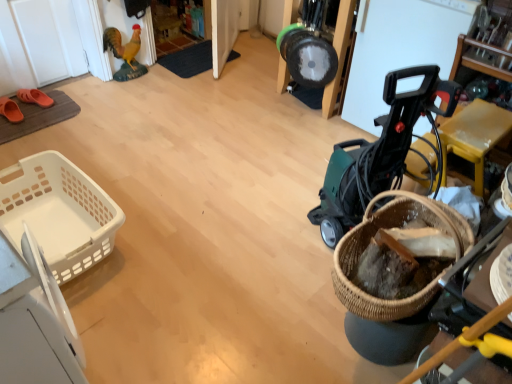
Question: Is woven brown basket at lower right, the 2th basket viewed from the left, next to orange rubber clog at left, which ranks as the 1th footwear in back-to-front order, and touching it?

Choices:
 (A) no
 (B) yes

Answer: (A)

Question: Would you say woven brown basket at lower right, positioned as the 2th basket in back-to-front order, is outside orange rubber clog at left, which ranks as the 1th footwear in back-to-front order?

Choices:
 (A) no
 (B) yes

Answer: (B)

Question: Considering the relative positions of woven brown basket at lower right, positioned as the 2th basket in back-to-front order, and orange rubber clog at left, which ranks as the 1th footwear in back-to-front order, in the image provided, is woven brown basket at lower right, positioned as the 2th basket in back-to-front order, to the left of orange rubber clog at left, which ranks as the 1th footwear in back-to-front order, from the viewer's perspective?

Choices:
 (A) yes
 (B) no

Answer: (B)

Question: Does woven brown basket at lower right, arranged as the 1th basket when viewed from the front, have a smaller size compared to orange rubber clog at left, marked as the 2th footwear in a front-to-back arrangement?

Choices:
 (A) yes
 (B) no

Answer: (B)

Question: Does woven brown basket at lower right, the 2th basket viewed from the left, have a greater width compared to orange rubber clog at left, marked as the 2th footwear in a front-to-back arrangement?

Choices:
 (A) yes
 (B) no

Answer: (B)

Question: From their relative heights in the image, would you say orange rubber sandals at left, the second footwear in the back-to-front sequence, is taller or shorter than green plastic baby carriage at right?

Choices:
 (A) tall
 (B) short

Answer: (B)

Question: Based on their positions, is orange rubber sandals at left, the second footwear in the back-to-front sequence, located to the left or right of green plastic baby carriage at right?

Choices:
 (A) right
 (B) left

Answer: (B)

Question: Is point coord(19,109) positioned closer to the camera than point coord(364,182)?

Choices:
 (A) farther
 (B) closer

Answer: (A)

Question: Is orange rubber sandals at left, the second footwear in the back-to-front sequence, wider or thinner than green plastic baby carriage at right?

Choices:
 (A) thin
 (B) wide

Answer: (A)

Question: Is orange rubber clog at left, marked as the 2th footwear in a front-to-back arrangement, in front of or behind orange rubber sandals at left, the second footwear in the back-to-front sequence, in the image?

Choices:
 (A) front
 (B) behind

Answer: (B)

Question: In terms of size, does orange rubber clog at left, marked as the 2th footwear in a front-to-back arrangement, appear bigger or smaller than orange rubber sandals at left, the second footwear in the back-to-front sequence?

Choices:
 (A) small
 (B) big

Answer: (A)

Question: Considering the positions of point tap(44, 102) and point tap(18, 122), is point tap(44, 102) closer or farther from the camera than point tap(18, 122)?

Choices:
 (A) farther
 (B) closer

Answer: (A)

Question: Is orange rubber clog at left, marked as the 2th footwear in a front-to-back arrangement, to the left or to the right of orange rubber sandals at left, the second footwear in the back-to-front sequence, in the image?

Choices:
 (A) left
 (B) right

Answer: (B)

Question: Do you think black plastic bucket at upper center is within orange rubber sandals at left, the second footwear in the back-to-front sequence, or outside of it?

Choices:
 (A) inside
 (B) outside

Answer: (B)

Question: From the image's perspective, is black plastic bucket at upper center positioned above or below orange rubber sandals at left, the second footwear in the back-to-front sequence?

Choices:
 (A) below
 (B) above

Answer: (B)